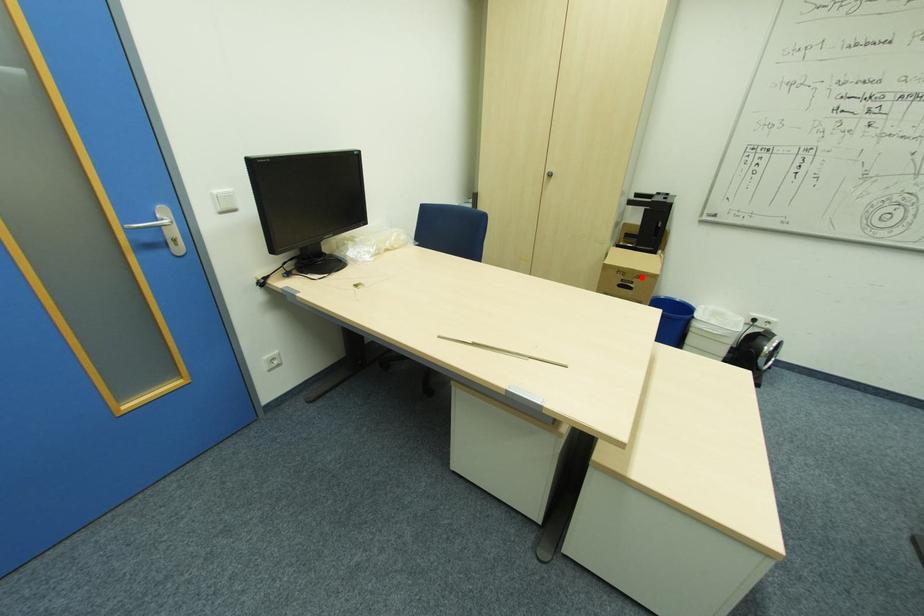
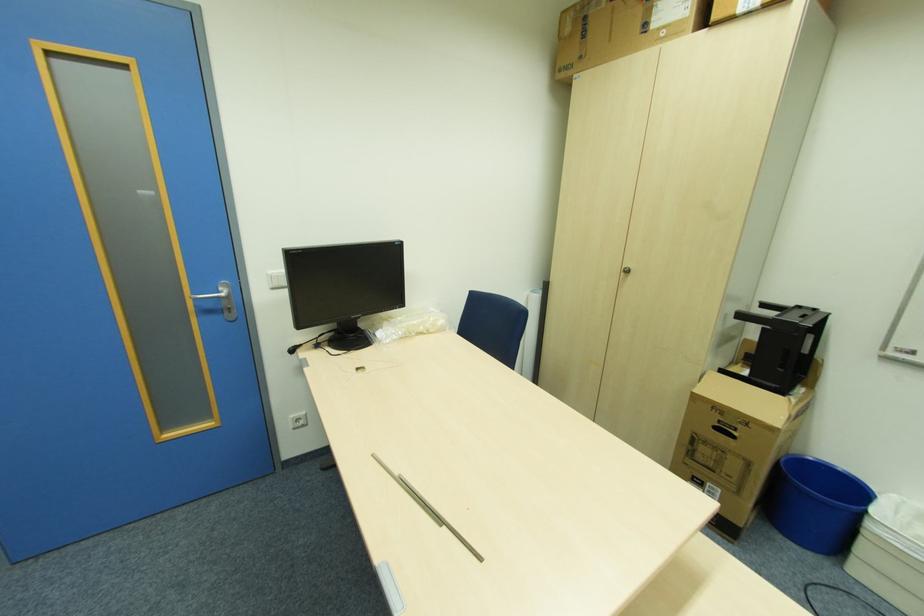
Question: I am providing you with two images of the same scene from different viewpoints. A red point is shown in image1. For the corresponding object point in image2, is it positioned nearer or farther from the camera?

Choices:
 (A) Nearer
 (B) Farther

Answer: (B)